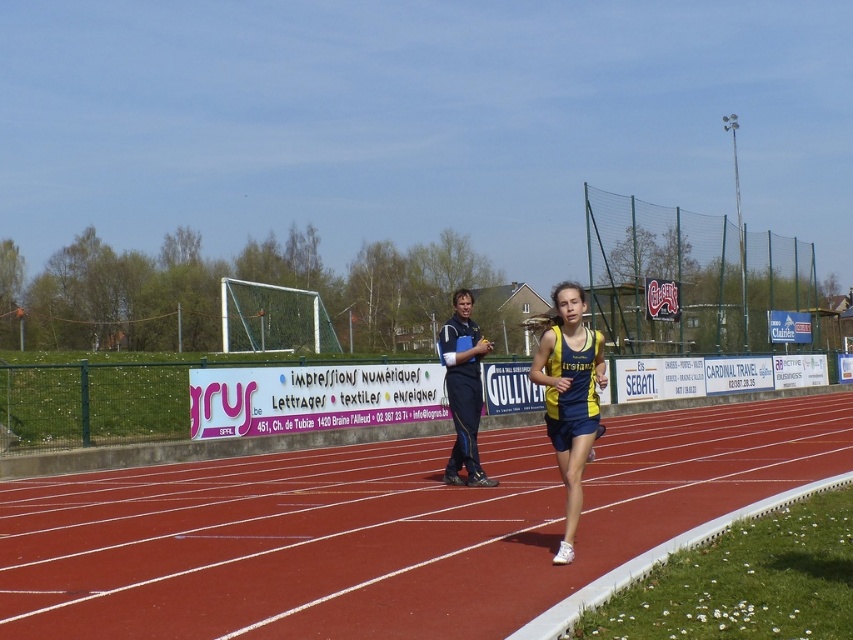
Question: Does rubberized red track at center appear over blue fabric jacket at center?

Choices:
 (A) yes
 (B) no

Answer: (B)

Question: Which of these objects is positioned closest to the blue fabric jacket at center?

Choices:
 (A) rubberized red track at center
 (B) yellow fabric running suit at center

Answer: (B)

Question: Which of the following is the closest to the observer?

Choices:
 (A) blue fabric jacket at center
 (B) rubberized red track at center
 (C) yellow fabric running suit at center

Answer: (B)

Question: Is rubberized red track at center further to the viewer compared to yellow fabric running suit at center?

Choices:
 (A) no
 (B) yes

Answer: (A)

Question: Is rubberized red track at center further to camera compared to yellow fabric running suit at center?

Choices:
 (A) no
 (B) yes

Answer: (A)

Question: Which of the following is the closest to the observer?

Choices:
 (A) blue fabric jacket at center
 (B) yellow fabric running suit at center

Answer: (B)